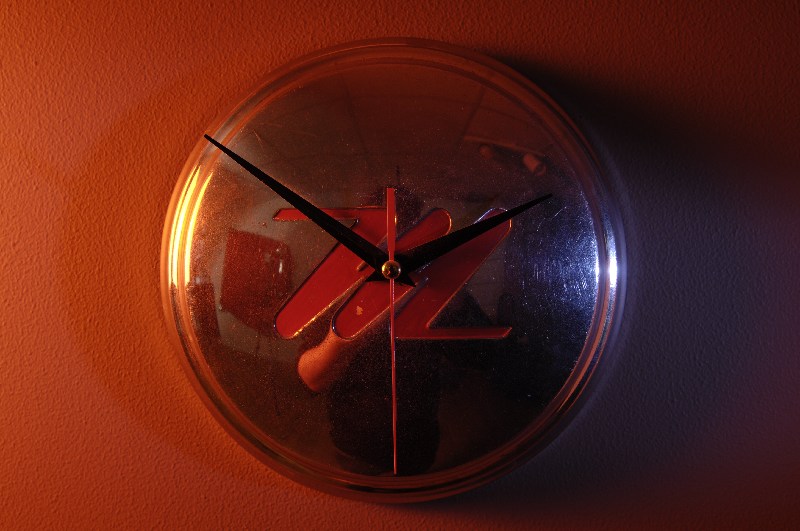
The width and height of the screenshot is (800, 531). Identify the location of glass cover. (422, 136).